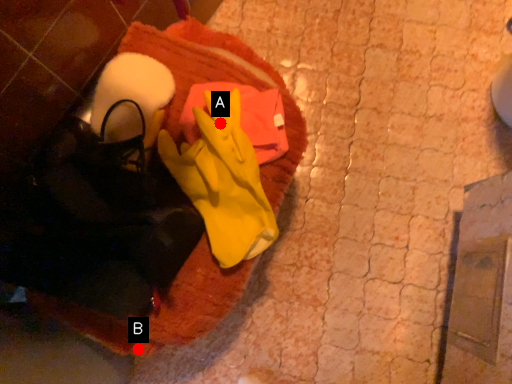
Question: Two points are circled on the image, labeled by A and B beside each circle. Which point is farther from the camera taking this photo?

Choices:
 (A) A is further
 (B) B is further

Answer: (B)